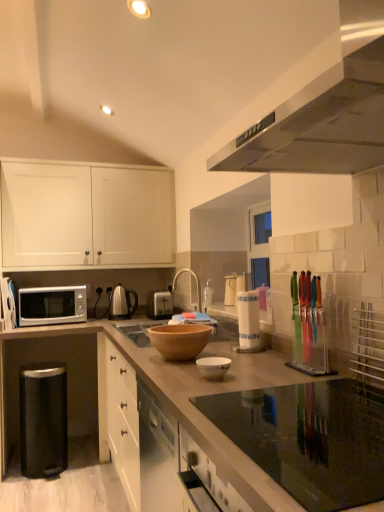
Question: Does silver metallic toaster at center, the second appliance in the left-to-right sequence, have a smaller size compared to white glossy bowl at center?

Choices:
 (A) yes
 (B) no

Answer: (B)

Question: Considering the relative sizes of silver metallic toaster at center, the 4th appliance positioned from the right, and white glossy bowl at center in the image provided, is silver metallic toaster at center, the 4th appliance positioned from the right, bigger than white glossy bowl at center?

Choices:
 (A) yes
 (B) no

Answer: (A)

Question: Is silver metallic toaster at center, the 5th appliance viewed from the front, to the right of white glossy bowl at center from the viewer's perspective?

Choices:
 (A) yes
 (B) no

Answer: (B)

Question: Is silver metallic toaster at center, acting as the 1th appliance starting from the back, to the left of white glossy bowl at center from the viewer's perspective?

Choices:
 (A) yes
 (B) no

Answer: (A)

Question: From a real-world perspective, is silver metallic toaster at center, acting as the 1th appliance starting from the back, over white glossy bowl at center?

Choices:
 (A) no
 (B) yes

Answer: (B)

Question: From the image's perspective, is silver metallic toaster at center, the 5th appliance viewed from the front, positioned above or below silver metallic microwave at left, marked as the first appliance in a left-to-right arrangement?

Choices:
 (A) below
 (B) above

Answer: (A)

Question: From a real-world perspective, relative to silver metallic microwave at left, marked as the first appliance in a left-to-right arrangement, is silver metallic toaster at center, the second appliance in the left-to-right sequence, vertically above or below?

Choices:
 (A) above
 (B) below

Answer: (B)

Question: Considering their positions, is silver metallic toaster at center, acting as the 1th appliance starting from the back, located in front of or behind silver metallic microwave at left, the 2th appliance from the back?

Choices:
 (A) behind
 (B) front

Answer: (A)

Question: Does point (147, 303) appear closer or farther from the camera than point (3, 293)?

Choices:
 (A) farther
 (B) closer

Answer: (A)

Question: From the image's perspective, is clear plastic knife block at right, the first appliance positioned from the right, located above or below silver metallic microwave at left, marked as the first appliance in a left-to-right arrangement?

Choices:
 (A) above
 (B) below

Answer: (A)

Question: Is clear plastic knife block at right, the first appliance positioned from the right, to the left or to the right of silver metallic microwave at left, marked as the first appliance in a left-to-right arrangement, in the image?

Choices:
 (A) right
 (B) left

Answer: (A)

Question: Is clear plastic knife block at right, the fifth appliance viewed from the back, in front of or behind silver metallic microwave at left, marked as the fifth appliance in a right-to-left arrangement, in the image?

Choices:
 (A) behind
 (B) front

Answer: (B)

Question: Based on their sizes in the image, would you say clear plastic knife block at right, placed as the fifth appliance when sorted from left to right, is bigger or smaller than silver metallic microwave at left, marked as the fifth appliance in a right-to-left arrangement?

Choices:
 (A) big
 (B) small

Answer: (B)

Question: From the image's perspective, is white matte cabinet at upper left positioned above or below silver metallic microwave at lower left?

Choices:
 (A) above
 (B) below

Answer: (A)

Question: Would you say white matte cabinet at upper left is to the left or to the right of silver metallic microwave at lower left in the picture?

Choices:
 (A) right
 (B) left

Answer: (A)